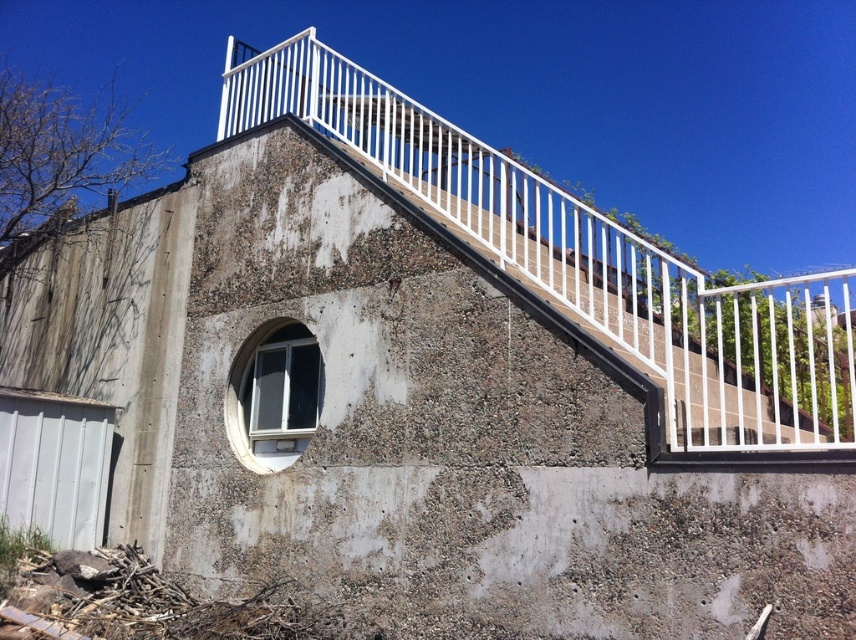
Question: Does white metal railing at upper center appear over clear glass window at center?

Choices:
 (A) yes
 (B) no

Answer: (A)

Question: Is white metal railing at upper center wider than clear glass window at center?

Choices:
 (A) no
 (B) yes

Answer: (A)

Question: Among these points, which one is farthest from the camera?

Choices:
 (A) (278, 388)
 (B) (845, 300)

Answer: (B)

Question: Is white metal railing at upper center to the right of clear glass window at center from the viewer's perspective?

Choices:
 (A) yes
 (B) no

Answer: (A)